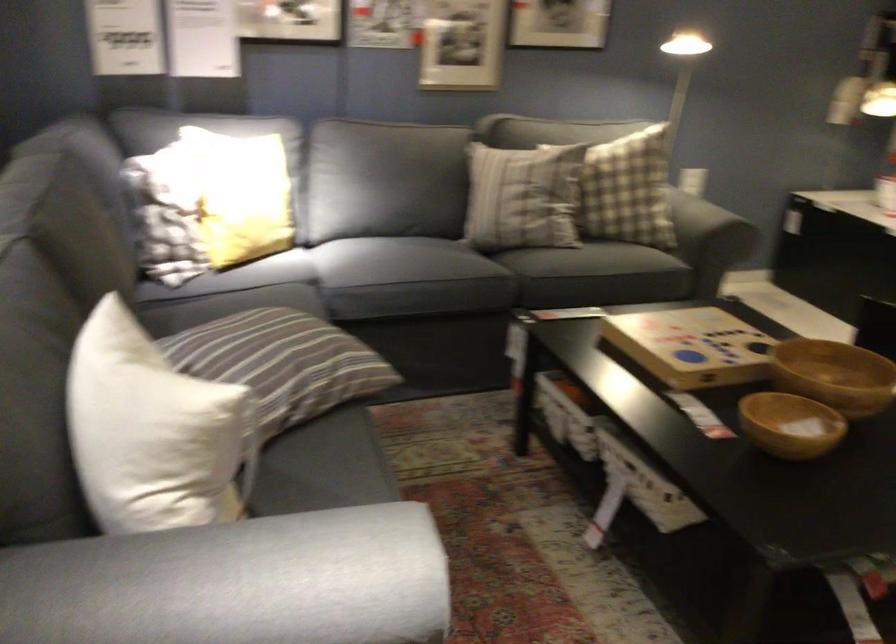
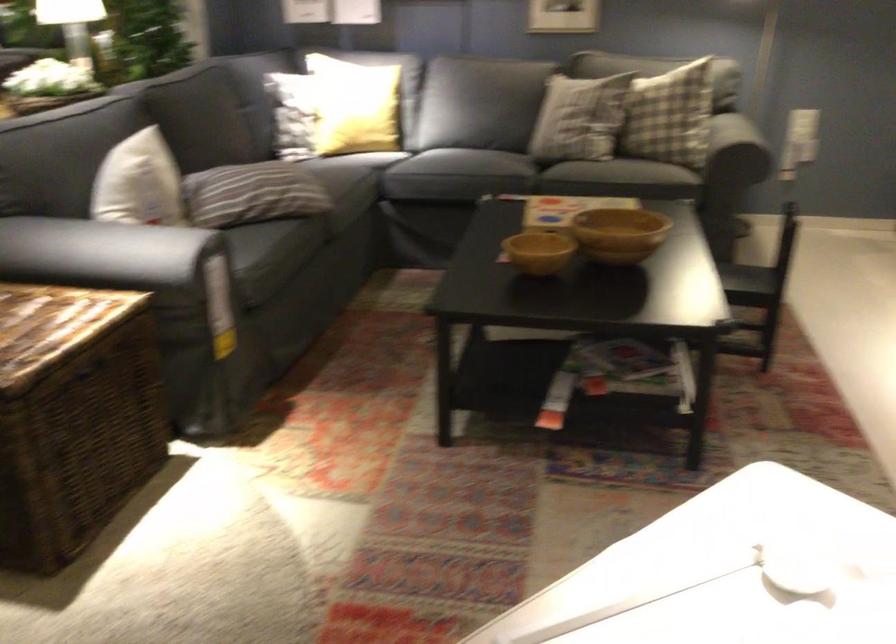
Where in the second image is the point corresponding to (x=814, y=375) from the first image?

(618, 234)